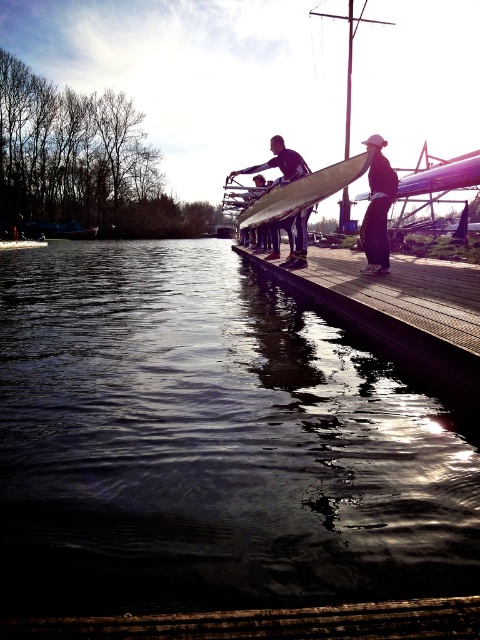
Question: Observing the image, what is the correct spatial positioning of wooden dock at center in reference to smooth white surfboard at center?

Choices:
 (A) right
 (B) left

Answer: (A)

Question: Among these points, which one is farthest from the camera?

Choices:
 (A) (104, 305)
 (B) (260, 218)

Answer: (B)

Question: Can you confirm if dark reflective water at center is positioned below wooden dock at center?

Choices:
 (A) no
 (B) yes

Answer: (B)

Question: Can you confirm if smooth white surfboard at center is thinner than black matte surfboard at center?

Choices:
 (A) yes
 (B) no

Answer: (B)

Question: Which object is closer to the camera taking this photo?

Choices:
 (A) black matte surfboard at center
 (B) smooth white surfboard at center

Answer: (B)

Question: Which point appears closest to the camera in this image?

Choices:
 (A) (388, 200)
 (B) (393, 307)

Answer: (B)